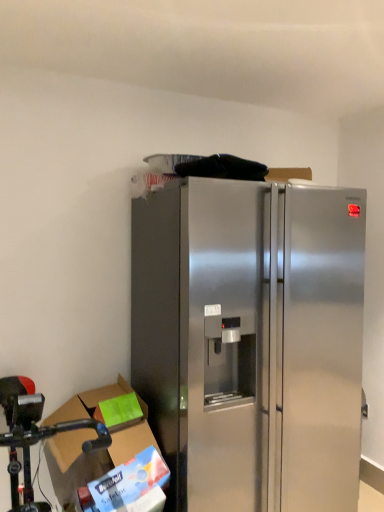
Question: Can you confirm if stainless steel refrigerator at center is wider than cardboard box at lower left?

Choices:
 (A) yes
 (B) no

Answer: (A)

Question: Is stainless steel refrigerator at center in front of cardboard box at lower left?

Choices:
 (A) no
 (B) yes

Answer: (B)

Question: Is stainless steel refrigerator at center aimed at cardboard box at lower left?

Choices:
 (A) yes
 (B) no

Answer: (B)

Question: From the image's perspective, is stainless steel refrigerator at center under cardboard box at lower left?

Choices:
 (A) yes
 (B) no

Answer: (B)

Question: Is the depth of stainless steel refrigerator at center greater than that of cardboard box at lower left?

Choices:
 (A) no
 (B) yes

Answer: (A)

Question: Considering the relative positions of stainless steel fridge at lower left and stainless steel refrigerator at center in the image provided, is stainless steel fridge at lower left to the left or to the right of stainless steel refrigerator at center?

Choices:
 (A) right
 (B) left

Answer: (B)

Question: Choose the correct answer: Is stainless steel fridge at lower left inside stainless steel refrigerator at center or outside it?

Choices:
 (A) outside
 (B) inside

Answer: (A)

Question: Is point (39, 431) closer or farther from the camera than point (261, 227)?

Choices:
 (A) farther
 (B) closer

Answer: (B)

Question: Relative to stainless steel refrigerator at center, is stainless steel fridge at lower left in front or behind?

Choices:
 (A) behind
 (B) front

Answer: (B)

Question: From the image's perspective, is stainless steel fridge at lower left located above or below cardboard box at lower left?

Choices:
 (A) above
 (B) below

Answer: (B)

Question: Relative to cardboard box at lower left, is stainless steel fridge at lower left in front or behind?

Choices:
 (A) front
 (B) behind

Answer: (A)

Question: Does point (8, 455) appear closer or farther from the camera than point (89, 396)?

Choices:
 (A) closer
 (B) farther

Answer: (A)

Question: Considering the positions of stainless steel fridge at lower left and cardboard box at lower left in the image, is stainless steel fridge at lower left bigger or smaller than cardboard box at lower left?

Choices:
 (A) small
 (B) big

Answer: (B)

Question: Is cardboard box at lower left bigger or smaller than stainless steel refrigerator at center?

Choices:
 (A) small
 (B) big

Answer: (A)

Question: From a real-world perspective, is cardboard box at lower left above or below stainless steel refrigerator at center?

Choices:
 (A) above
 (B) below

Answer: (B)